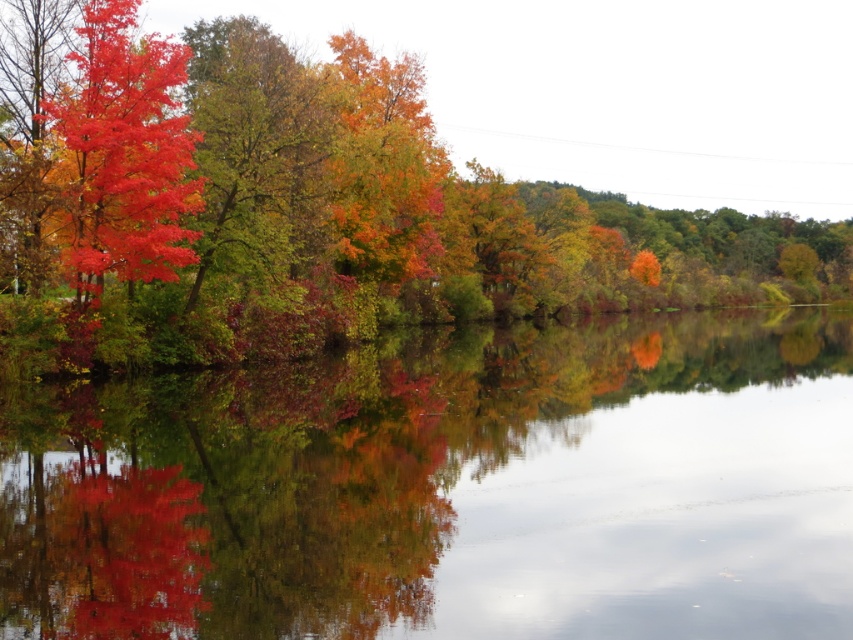
You are standing at the edge of the water and see both the shiny red leaves at left and the matte red leaves at left. Which set of leaves is nearer to you?

The shiny red leaves at left are closer to the viewer than the matte red leaves at left.

You are standing in the autumn landscape and want to take a photo of the matte red tree at lower left and the transparent glass water at center. Which object should you frame first in your camera viewfinder to ensure both are in the shot?

You should frame the matte red tree at lower left first because it is to the left of the transparent glass water at center, so starting with the leftmost object ensures both are included in the viewfinder.

You are an artist planning to paint the autumn scene. You want to ensure the transparent glass water at center and the matte red tree at lower left are positioned correctly. According to the scene, which object is placed above the other?

The transparent glass water at center is positioned over matte red tree at lower left.